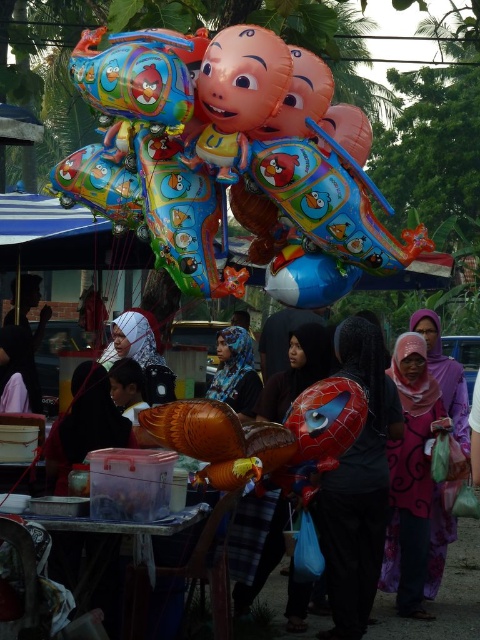
Does purple printed scarf at center appear on the left side of pink satin hijab at center?

Correct, you'll find purple printed scarf at center to the left of pink satin hijab at center.

Is purple printed scarf at center shorter than pink satin hijab at center?

No.

Does point (419, 604) come behind point (436, 563)?

No, it is not.

Where is `purple printed scarf at center`? Image resolution: width=480 pixels, height=640 pixels. purple printed scarf at center is located at coordinates point(411,474).

Between spiderman balloon at center and blue printed scarf at center, which one has less height?

blue printed scarf at center

Which is behind, point (372, 412) or point (251, 396)?

Point (251, 396)

Locate an element on the screen. The width and height of the screenshot is (480, 640). spiderman balloon at center is located at coordinates (358, 484).

Find the location of a particular element. This screenshot has height=640, width=480. pink satin hijab at center is located at coordinates (444, 374).

Which is more to the right, pink satin hijab at center or blue printed scarf at center?

pink satin hijab at center

Where is `pink satin hijab at center`? pink satin hijab at center is located at coordinates (444, 374).

Locate an element on the screen. pink satin hijab at center is located at coordinates (444, 374).